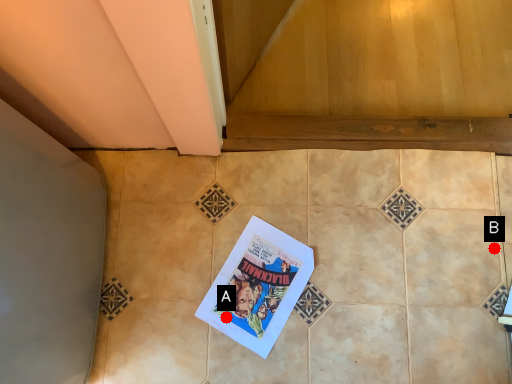
Question: Two points are circled on the image, labeled by A and B beside each circle. Among these points, which one is farthest from the camera?

Choices:
 (A) A is further
 (B) B is further

Answer: (B)